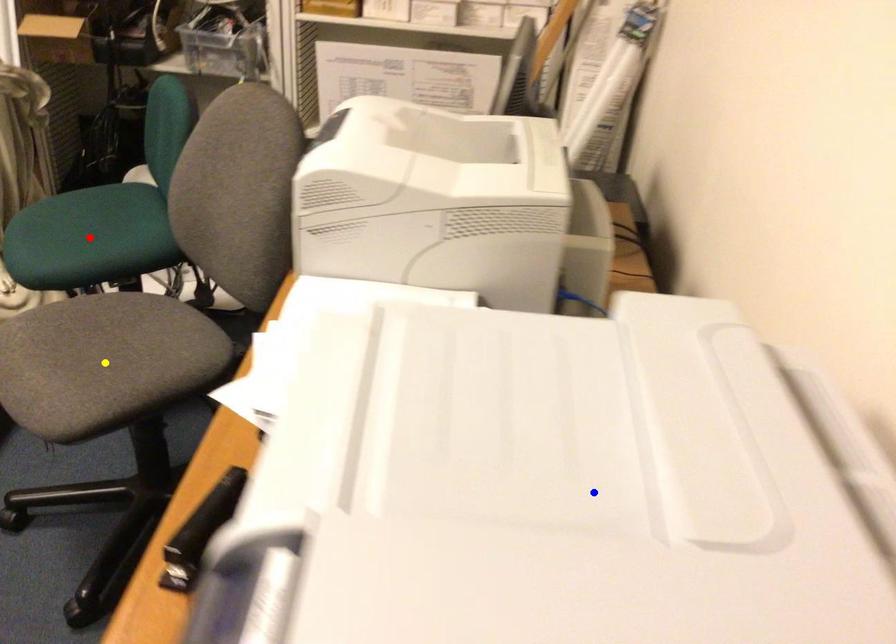
In the scene shown: Order these from nearest to farthest:
A) blue point
B) yellow point
C) red point

blue point → yellow point → red point